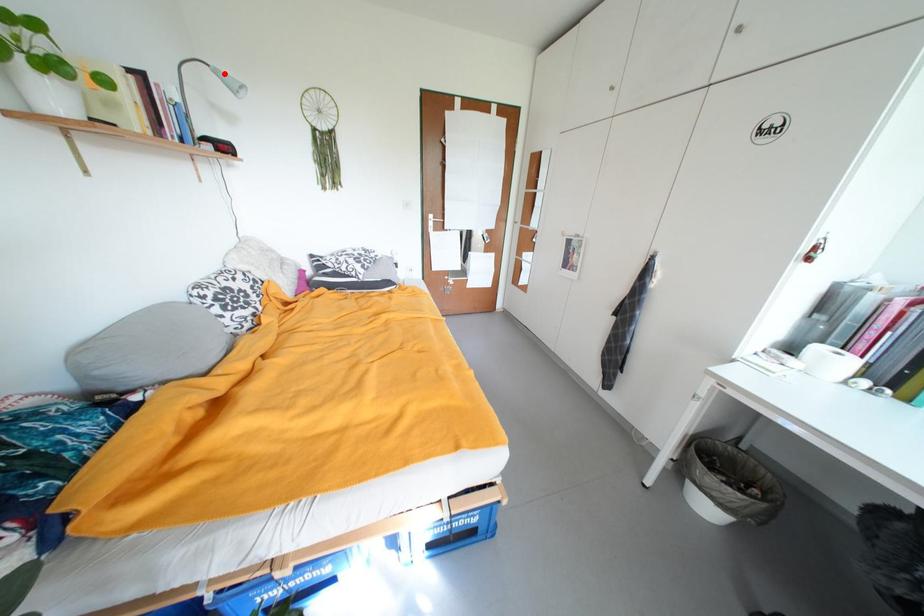
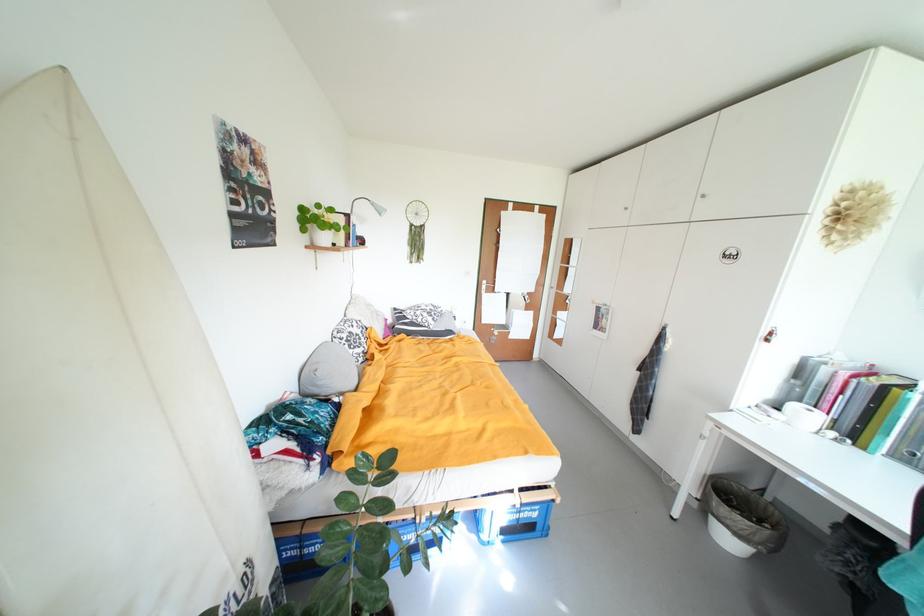
The point at the highlighted location is marked in the first image. Where is the corresponding point in the second image?

(381, 206)